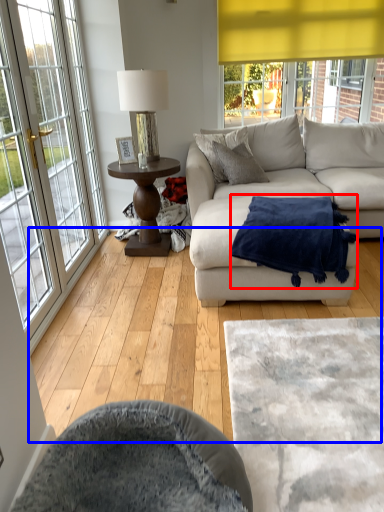
Question: Which point is closer to the camera, blanket (highlighted by a red box) or hardwood (highlighted by a blue box)?

Choices:
 (A) blanket
 (B) hardwood

Answer: (B)